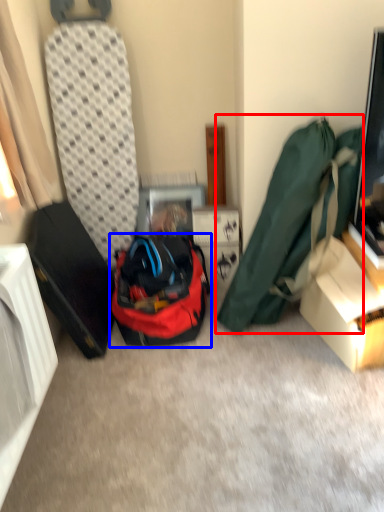
Question: Among these objects, which one is nearest to the camera, luggage and bags (highlighted by a red box) or backpack (highlighted by a blue box)?

Choices:
 (A) luggage and bags
 (B) backpack

Answer: (A)